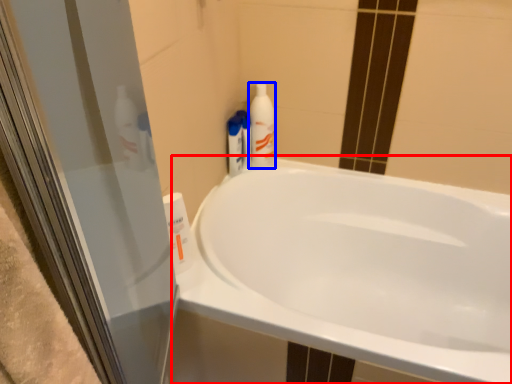
Question: Among these objects, which one is farthest to the camera, bathtub (highlighted by a red box) or cleaning product (highlighted by a blue box)?

Choices:
 (A) bathtub
 (B) cleaning product

Answer: (B)